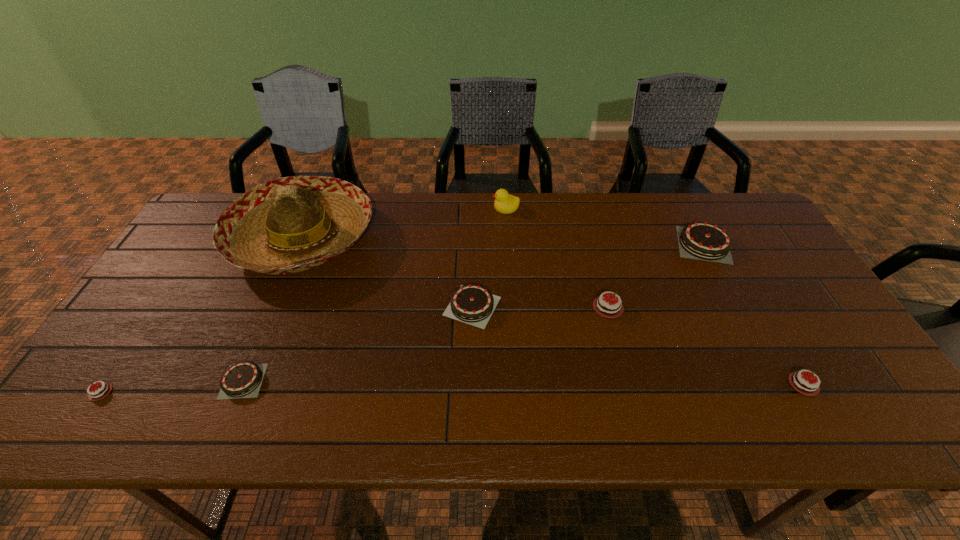
Locate an element on the screen. This screenshot has height=540, width=960. free spot located 0.060m on the right of the second red chocolate cake from right to left is located at coordinates (663, 307).

This screenshot has width=960, height=540. What are the coordinates of `vacant area located on the left of the second brown chocolate cake from left to right` in the screenshot? It's located at (402, 306).

The height and width of the screenshot is (540, 960). Identify the location of vacant space located 0.100m on the left of the second smallest red chocolate cake. (728, 384).

This screenshot has height=540, width=960. Identify the location of vacant region located on the right of the smallest brown chocolate cake. (379, 381).

Locate an element on the screen. The width and height of the screenshot is (960, 540). vacant space located 0.210m on the right of the leftmost chocolate cake is located at coordinates (212, 392).

Identify the location of sombrero present at the far edge. (291, 224).

The width and height of the screenshot is (960, 540). What are the coordinates of `duckling present at the far edge` in the screenshot? It's located at (505, 203).

Identify the location of chocolate cake present at the far edge. [x=702, y=240].

Find the location of a particular element. The image size is (960, 540). sombrero at the left edge is located at coordinates (291, 224).

Image resolution: width=960 pixels, height=540 pixels. In order to click on chocolate cake that is at the left edge in this screenshot , I will do `click(100, 392)`.